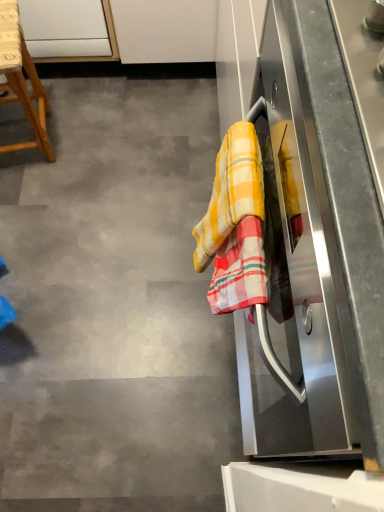
This screenshot has height=512, width=384. Find the location of `vacant area located to the right-hand side of wooden stool at left`. vacant area located to the right-hand side of wooden stool at left is located at coordinates (96, 138).